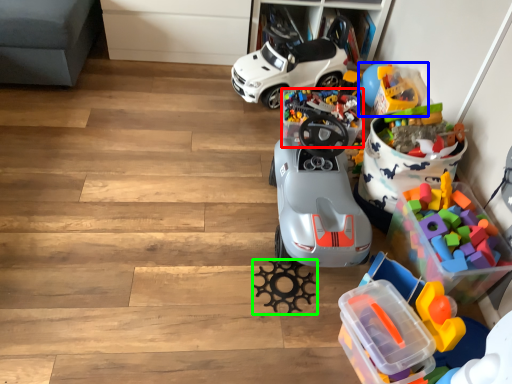
Question: Which object is the farthest from toy (highlighted by a red box)? Choose among these: toy (highlighted by a blue box) or toy (highlighted by a green box).

Choices:
 (A) toy
 (B) toy

Answer: (B)